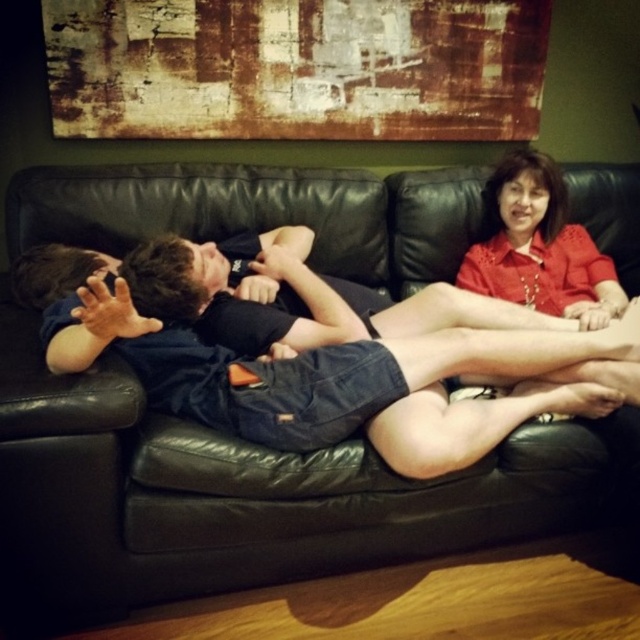
Does black leather couch at center have a smaller size compared to matte red blouse at upper right?

Incorrect, black leather couch at center is not smaller in size than matte red blouse at upper right.

Is point (326, 216) less distant than point (563, 273)?

Yes, it is in front of point (563, 273).

This screenshot has height=640, width=640. I want to click on black leather couch at center, so click(x=234, y=497).

Which is more to the left, denim shorts at center or matte red blouse at upper right?

denim shorts at center

Can you confirm if denim shorts at center is positioned above matte red blouse at upper right?

No.

Describe the element at coordinates (323, 369) in the screenshot. I see `denim shorts at center` at that location.

At what (x,y) coordinates should I click in order to perform the action: click on denim shorts at center. Please return your answer as a coordinate pair (x, y). Looking at the image, I should click on (323, 369).

Is black leather couch at center below denim shorts at center?

No.

In the scene shown: Does black leather couch at center have a greater height compared to denim shorts at center?

Yes.

Between point (173, 580) and point (208, 380), which one is positioned behind?

The point (208, 380) is more distant.

Find the location of a particular element. The width and height of the screenshot is (640, 640). black leather couch at center is located at coordinates (234, 497).